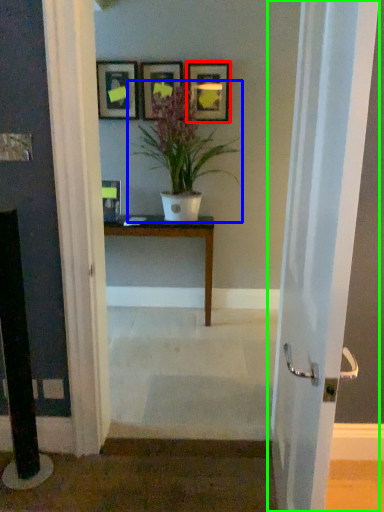
Question: Estimate the real-world distances between objects in this image. Which object is closer to picture frame (highlighted by a red box), houseplant (highlighted by a blue box) or door (highlighted by a green box)?

Choices:
 (A) houseplant
 (B) door

Answer: (A)